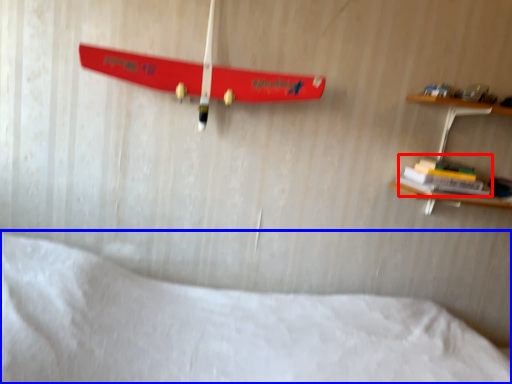
Question: Among these objects, which one is nearest to the camera, book (highlighted by a red box) or bed (highlighted by a blue box)?

Choices:
 (A) book
 (B) bed

Answer: (B)